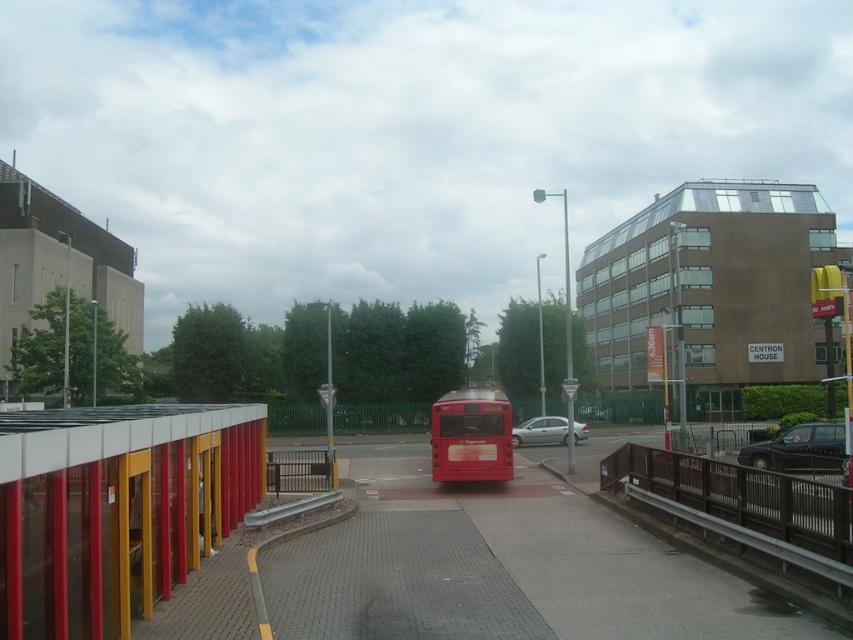
Question: Does metallic red bus stop at left appear on the left side of black metallic car at lower right?

Choices:
 (A) no
 (B) yes

Answer: (B)

Question: Observing the image, what is the correct spatial positioning of shiny red bus at center in reference to silver metallic car at center?

Choices:
 (A) above
 (B) below

Answer: (A)

Question: Which point is farther to the camera?

Choices:
 (A) metallic red bus stop at left
 (B) black metallic car at lower right

Answer: (B)

Question: Which of the following is the farthest from the observer?

Choices:
 (A) silver metallic car at center
 (B) black metallic car at lower right
 (C) shiny red bus at center
 (D) metallic red bus stop at left

Answer: (A)

Question: Does shiny red bus at center appear on the left side of silver metallic car at center?

Choices:
 (A) yes
 (B) no

Answer: (A)

Question: Among these points, which one is nearest to the camera?

Choices:
 (A) (467, 456)
 (B) (769, 448)
 (C) (541, 417)
 (D) (90, 541)

Answer: (D)